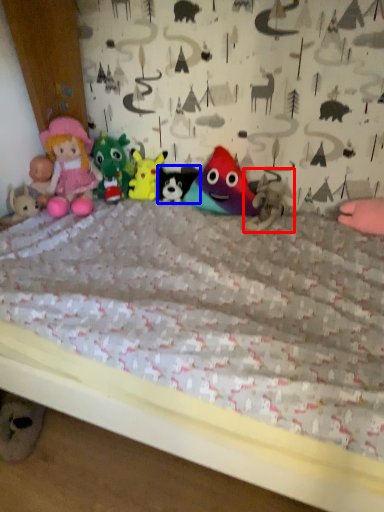
Question: Which of the following is the closest to the observer, toy (highlighted by a red box) or toy (highlighted by a blue box)?

Choices:
 (A) toy
 (B) toy

Answer: (A)